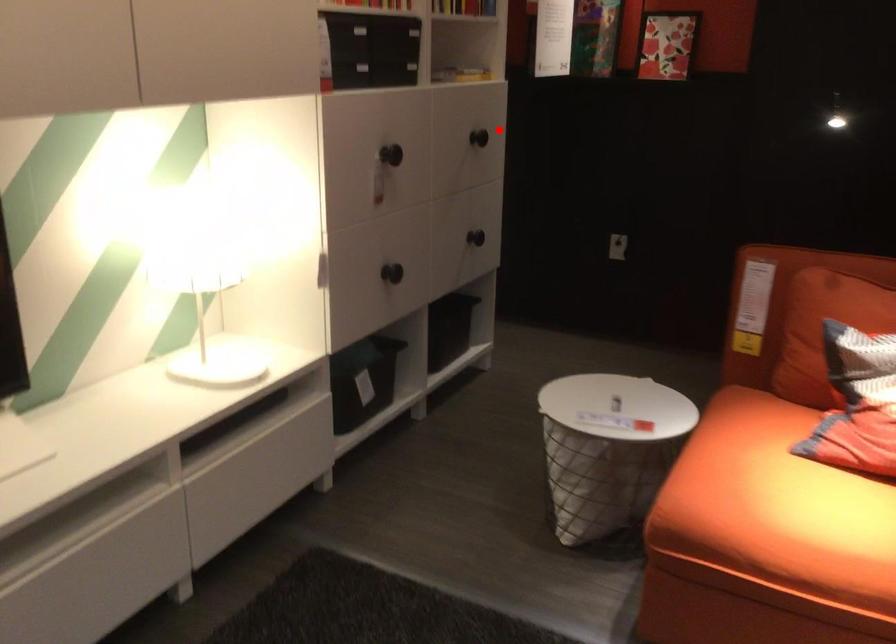
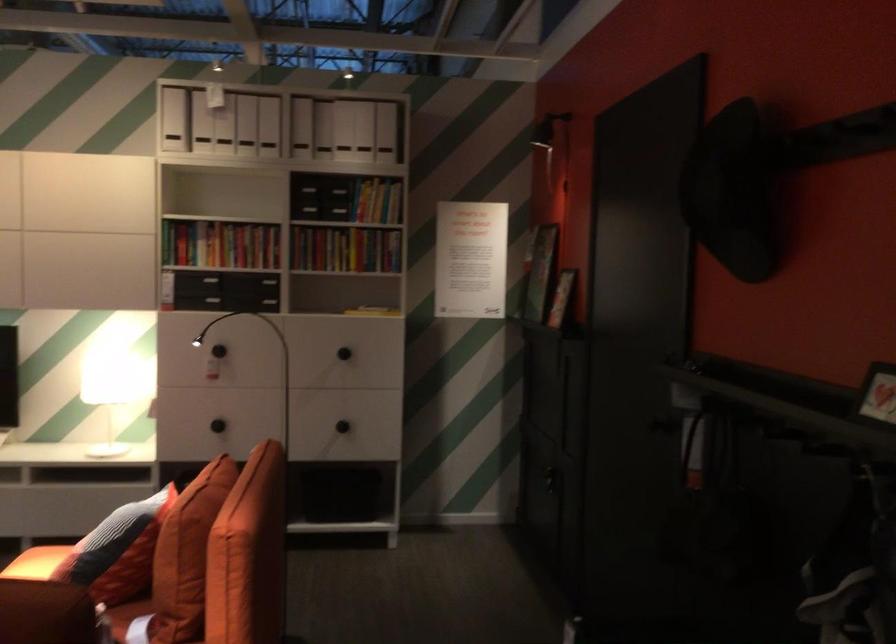
Question: I am providing you with two images of the same scene from different viewpoints. A red point is shown in image1. For the corresponding object point in image2, is it positioned nearer or farther from the camera?

Choices:
 (A) Nearer
 (B) Farther

Answer: (B)